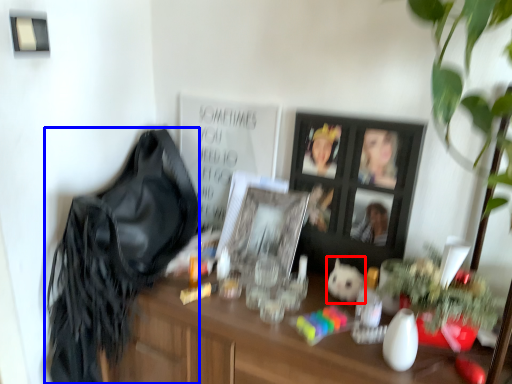
Question: Which object appears farthest to the camera in this image, animal (highlighted by a red box) or shoulder bag (highlighted by a blue box)?

Choices:
 (A) animal
 (B) shoulder bag

Answer: (A)